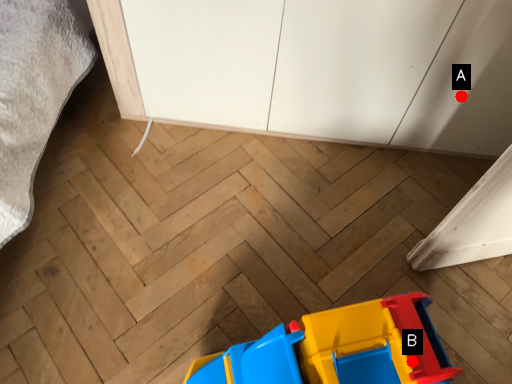
Question: Two points are circled on the image, labeled by A and B beside each circle. Which point is closer to the camera?

Choices:
 (A) A is closer
 (B) B is closer

Answer: (B)